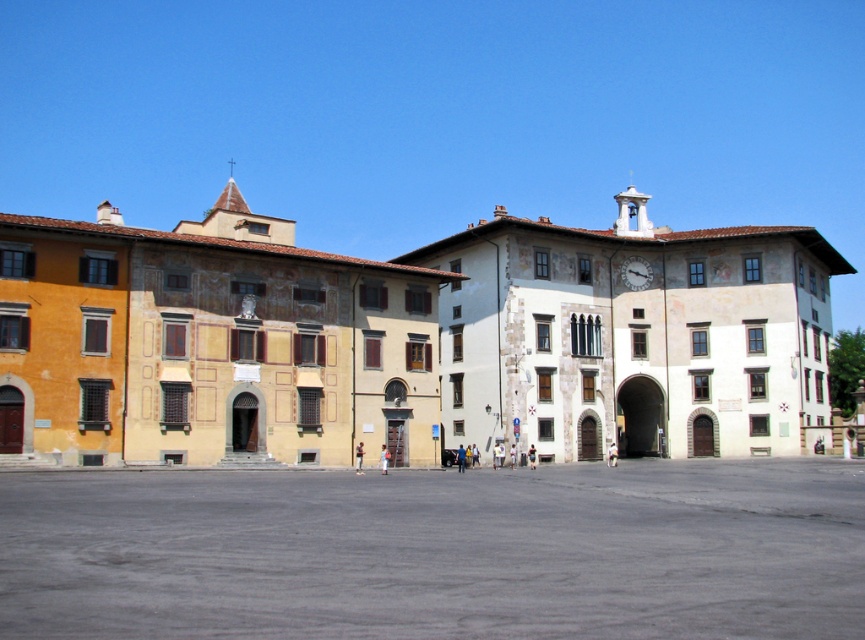
Question: Can you confirm if yellow painted building at center is positioned below matte brown clock at center-right?

Choices:
 (A) yes
 (B) no

Answer: (B)

Question: Is yellow painted building at center to the left of matte brown clock at center-right from the viewer's perspective?

Choices:
 (A) no
 (B) yes

Answer: (B)

Question: Which object is closer to the camera taking this photo?

Choices:
 (A) matte brown clock at center-right
 (B) yellow painted building at center

Answer: (B)

Question: Is yellow painted building at center in front of matte brown clock at center-right?

Choices:
 (A) no
 (B) yes

Answer: (B)

Question: Among these objects, which one is nearest to the camera?

Choices:
 (A) matte brown clock at center-right
 (B) yellow painted building at center

Answer: (B)